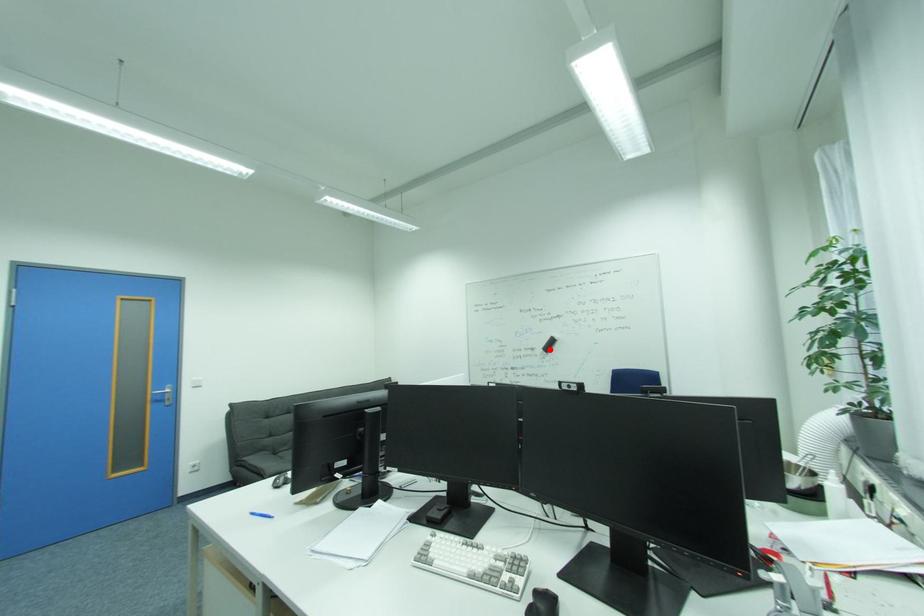
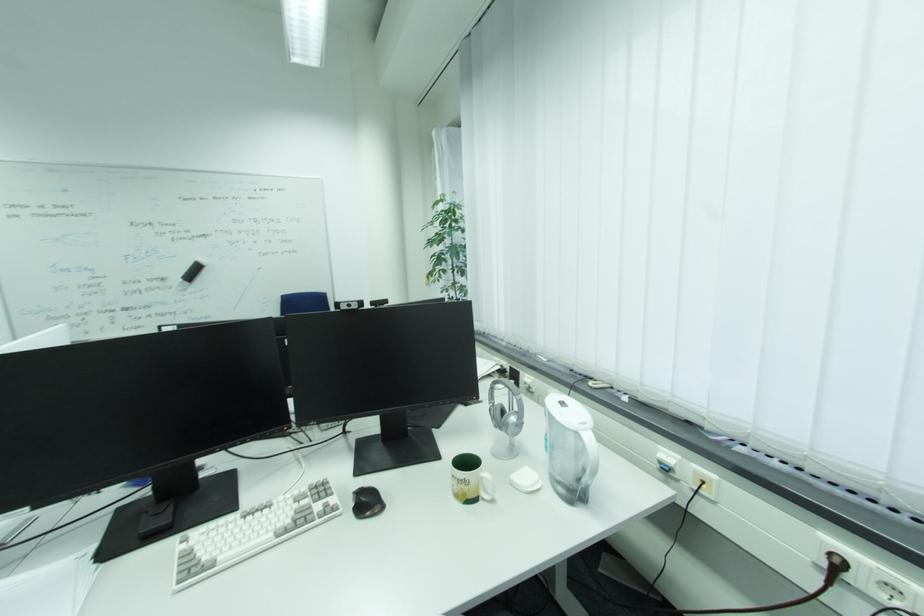
In the second image, find the point that corresponds to the highlighted location in the first image.

(189, 278)